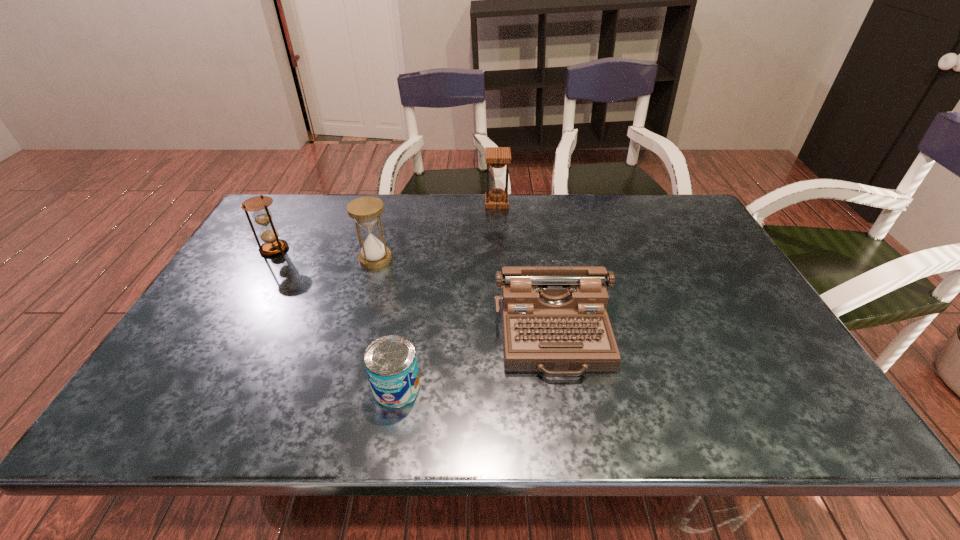
Image resolution: width=960 pixels, height=540 pixels. In order to click on free space located on the keyboard of the typewriter in this screenshot , I will do `click(566, 410)`.

At what (x,y) coordinates should I click in order to perform the action: click on free space located on the back of the third object from right to left. Please return your answer as a coordinate pair (x, y). The image size is (960, 540). Looking at the image, I should click on (418, 259).

Where is `object present at the far edge`? The height and width of the screenshot is (540, 960). object present at the far edge is located at coordinates (497, 158).

Where is `object present at the near edge`? This screenshot has height=540, width=960. object present at the near edge is located at coordinates [391, 364].

Image resolution: width=960 pixels, height=540 pixels. Find the location of `object that is at the left edge`. object that is at the left edge is located at coordinates (261, 215).

Identify the location of vacant region at the far edge of the desktop. click(439, 213).

The width and height of the screenshot is (960, 540). Find the location of `free space at the near edge of the desktop`. free space at the near edge of the desktop is located at coordinates (548, 407).

Find the location of `free space at the right edge of the desktop`. free space at the right edge of the desktop is located at coordinates (803, 388).

This screenshot has height=540, width=960. I want to click on blank space at the far right corner of the desktop, so click(680, 195).

This screenshot has width=960, height=540. I want to click on vacant area that lies between the leftmost object and the typewriter, so click(414, 292).